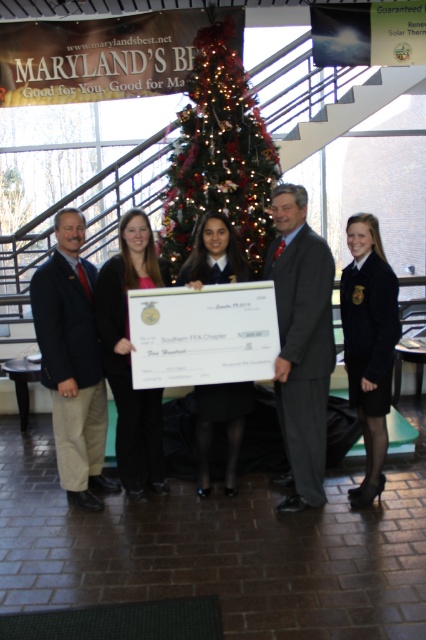
Which is more to the right, black uniform at right or matte black dress at center?

black uniform at right

Which of these two, black uniform at right or matte black dress at center, stands shorter?

matte black dress at center

The width and height of the screenshot is (426, 640). What do you see at coordinates (368, 344) in the screenshot?
I see `black uniform at right` at bounding box center [368, 344].

You are a GUI agent. You are given a task and a screenshot of the screen. Output one action in this format:
    pyautogui.click(x=<x>, y=<y>)
    Task: Click on the black uniform at right
    
    Given the screenshot: What is the action you would take?
    pyautogui.click(x=368, y=344)

Is navy blue suit at center below black uniform at right?

Incorrect, navy blue suit at center is not positioned below black uniform at right.

Can you confirm if navy blue suit at center is taller than black uniform at right?

Yes, navy blue suit at center is taller than black uniform at right.

This screenshot has height=640, width=426. What do you see at coordinates (72, 362) in the screenshot?
I see `navy blue suit at center` at bounding box center [72, 362].

Where is `navy blue suit at center`? navy blue suit at center is located at coordinates (72, 362).

Is shiny red christmas tree at center below pink fabric shirt at center?

No, shiny red christmas tree at center is not below pink fabric shirt at center.

Consider the image. Does shiny red christmas tree at center appear on the right side of pink fabric shirt at center?

Yes, shiny red christmas tree at center is to the right of pink fabric shirt at center.

Identify the location of shiny red christmas tree at center. The width and height of the screenshot is (426, 640). (219, 156).